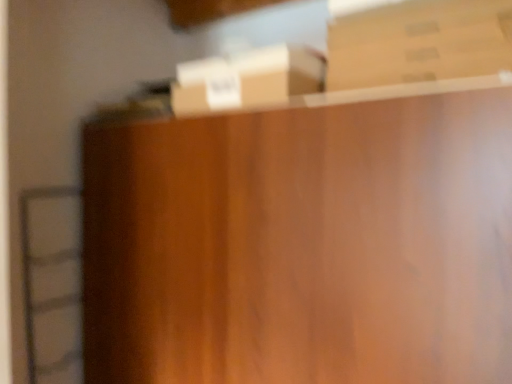
Question: From a real-world perspective, is brown cardboard box at upper right, which is the first box from right to left, above or below brown cardboard box at upper center, the second box viewed from the top?

Choices:
 (A) above
 (B) below

Answer: (A)

Question: In terms of height, does brown cardboard box at upper right, positioned as the 1th box in top-to-bottom order, look taller or shorter compared to brown cardboard box at upper center, which is the 2th box from right to left?

Choices:
 (A) tall
 (B) short

Answer: (B)

Question: Is point (384, 59) positioned closer to the camera than point (186, 109)?

Choices:
 (A) closer
 (B) farther

Answer: (A)

Question: Considering the positions of brown cardboard box at upper center, the 1th box positioned from the bottom, and brown cardboard box at upper right, the second box from the bottom, in the image, is brown cardboard box at upper center, the 1th box positioned from the bottom, wider or thinner than brown cardboard box at upper right, the second box from the bottom,?

Choices:
 (A) wide
 (B) thin

Answer: (B)

Question: From the image's perspective, is brown cardboard box at upper center, the first box positioned from the left, located above or below brown cardboard box at upper right, acting as the second box starting from the left?

Choices:
 (A) above
 (B) below

Answer: (B)

Question: Is brown cardboard box at upper center, the 1th box positioned from the bottom, inside or outside of brown cardboard box at upper right, which is the first box from right to left?

Choices:
 (A) outside
 (B) inside

Answer: (A)

Question: From a real-world perspective, is brown cardboard box at upper center, which is the 2th box from right to left, positioned above or below brown cardboard box at upper right, the second box from the bottom?

Choices:
 (A) below
 (B) above

Answer: (A)